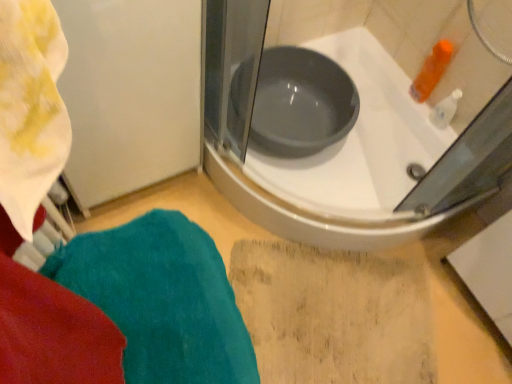
Question: Is teal plush towel at lower left in front of or behind matte gray basin at center in the image?

Choices:
 (A) front
 (B) behind

Answer: (A)

Question: Is teal plush towel at lower left inside the boundaries of matte gray basin at center, or outside?

Choices:
 (A) inside
 (B) outside

Answer: (B)

Question: Estimate the real-world distances between objects in this image. Which object is farther from the matte gray basin at center?

Choices:
 (A) teal plush towel at lower left
 (B) white glossy bathtub at upper center

Answer: (A)

Question: Which object is the farthest from the matte gray basin at center?

Choices:
 (A) teal plush towel at lower left
 (B) white glossy bathtub at upper center

Answer: (A)